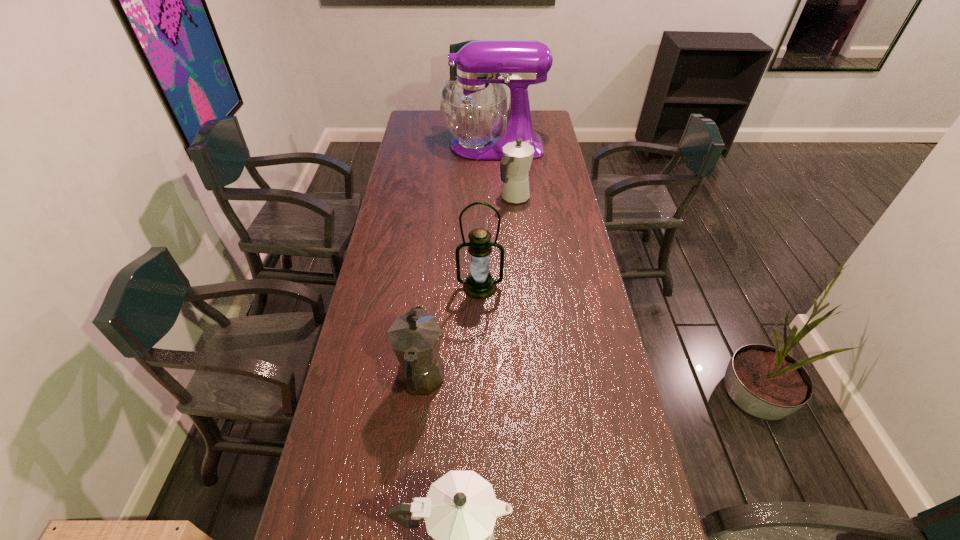
Find the location of `blank space located on the side where the second tallest object emits light`. blank space located on the side where the second tallest object emits light is located at coordinates (480, 352).

Locate an element on the screen. free space located 0.080m on the front of the rightmost coffeepot is located at coordinates (516, 222).

Where is `vacant space located 0.170m on the pouring side of the second nearest object`? vacant space located 0.170m on the pouring side of the second nearest object is located at coordinates (429, 305).

Where is `free space located 0.190m on the pouring side of the second nearest object`? This screenshot has width=960, height=540. free space located 0.190m on the pouring side of the second nearest object is located at coordinates (430, 300).

Where is `vacant space located 0.050m on the pouring side of the second nearest object`? Image resolution: width=960 pixels, height=540 pixels. vacant space located 0.050m on the pouring side of the second nearest object is located at coordinates (426, 334).

This screenshot has height=540, width=960. In order to click on object that is at the left edge in this screenshot , I will do `click(415, 337)`.

Where is `object present at the right edge`? object present at the right edge is located at coordinates (473, 107).

This screenshot has width=960, height=540. Identify the location of vacant area at the left edge of the desktop. (418, 229).

In the image, there is a desktop. Where is `free space at the right edge`? free space at the right edge is located at coordinates (566, 199).

What are the coordinates of `vacant space at the far left corner` in the screenshot? It's located at (409, 116).